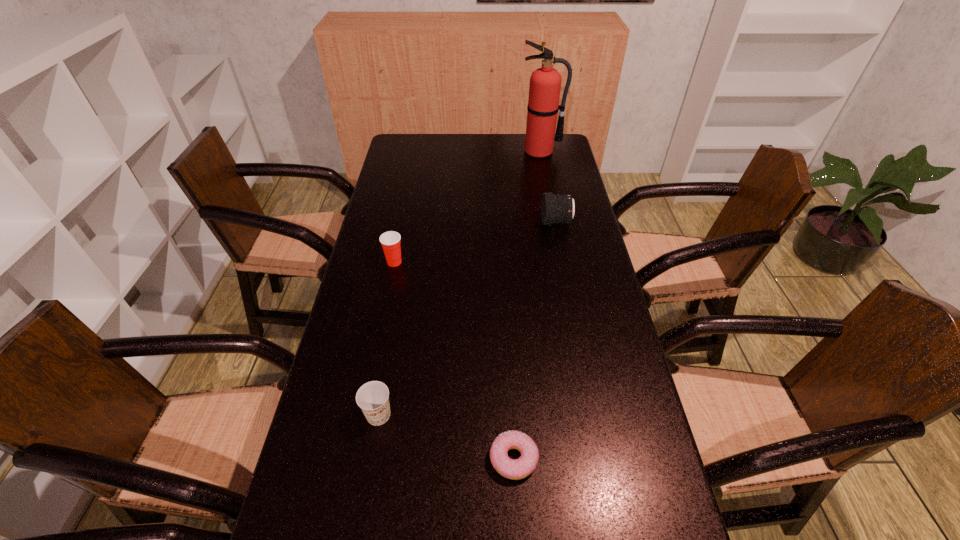
Identify the location of unoccupied area between the telephoto lens and the tallest object. (548, 187).

I want to click on empty space between the farther Dixie cup and the second shortest object, so click(387, 339).

Where is `unoccupied position between the fire extinguisher and the nearer Dixie cup`? unoccupied position between the fire extinguisher and the nearer Dixie cup is located at coordinates (459, 283).

You are a GUI agent. You are given a task and a screenshot of the screen. Output one action in this format:
    pyautogui.click(x=<x>, y=<y>)
    Task: Click on the object that stands as the second closest to the third farthest object
    
    Given the screenshot: What is the action you would take?
    pyautogui.click(x=557, y=208)

You are a GUI agent. You are given a task and a screenshot of the screen. Output one action in this format:
    pyautogui.click(x=<x>, y=<y>)
    Task: Click on the object that can be found as the closest to the third farthest object
    
    Given the screenshot: What is the action you would take?
    pyautogui.click(x=373, y=397)

Locate an element on the screen. free point that satisfies the following two spatial constraints: 1. on the front side of the third nearest object; 2. on the left side of the fourth farthest object is located at coordinates (364, 415).

The image size is (960, 540). I want to click on free space that satisfies the following two spatial constraints: 1. on the front side of the shorter Dixie cup; 2. on the right side of the third farthest object, so click(364, 415).